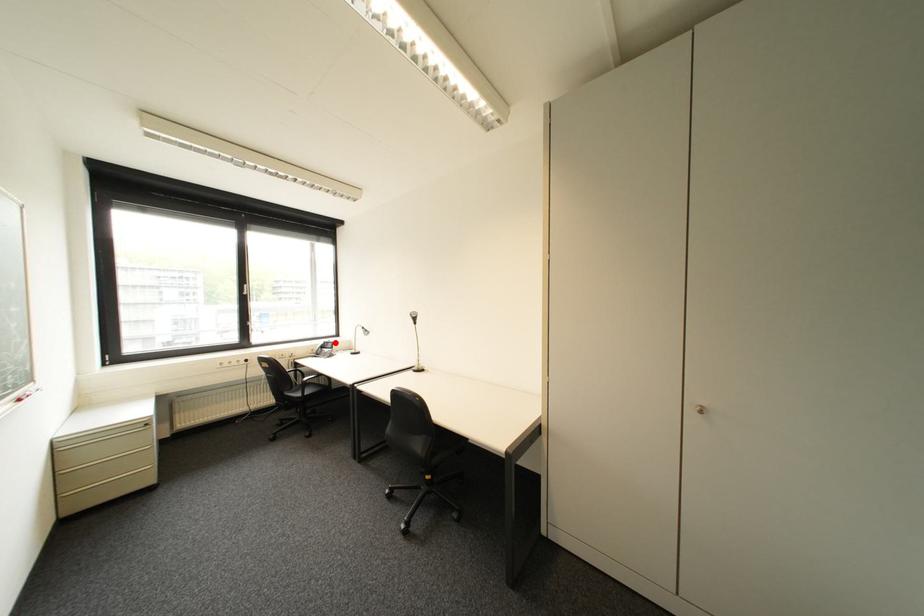
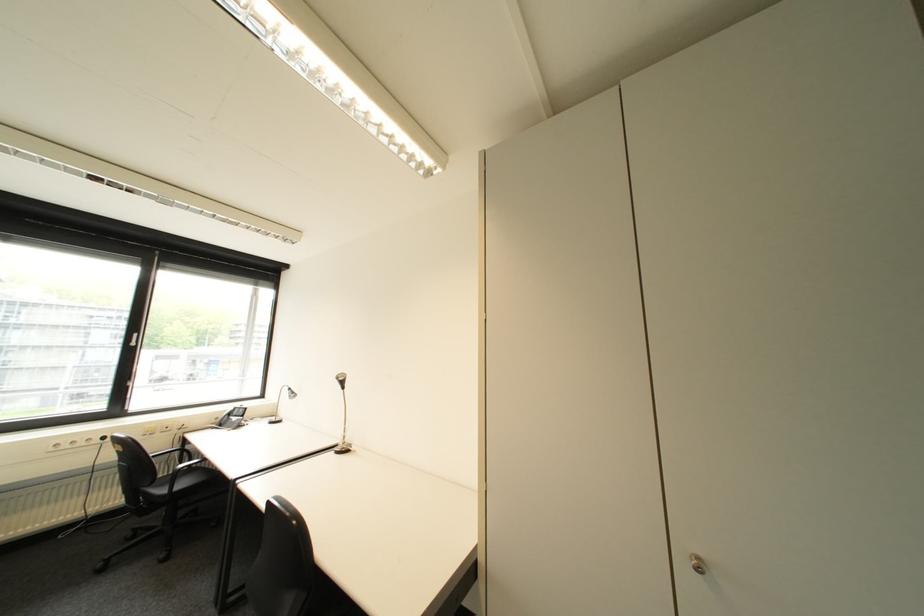
Question: I am providing you with two images of the same scene from different viewpoints. In image1, a red point is highlighted. Considering the same 3D point in image2, which of the following is correct?

Choices:
 (A) It is closer
 (B) It is farther

Answer: (A)